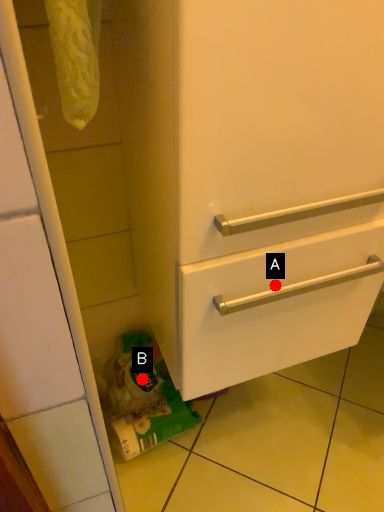
Question: Two points are circled on the image, labeled by A and B beside each circle. Among these points, which one is nearest to the camera?

Choices:
 (A) A is closer
 (B) B is closer

Answer: (A)